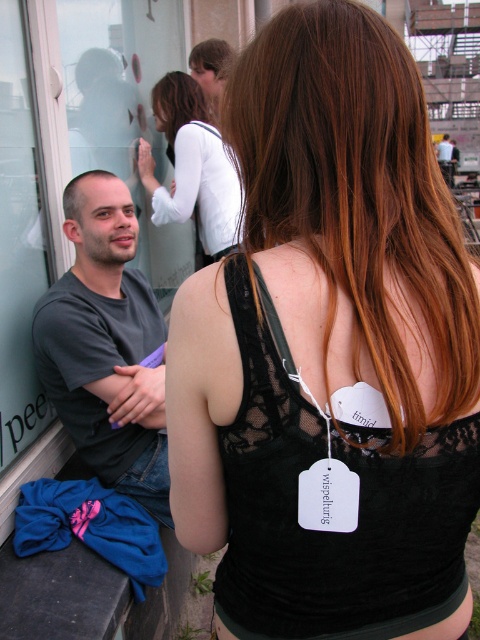
You are a photographer trying to capture the scene. The camera is set to focus on the woman in the foreground. If you want to adjust the focus to include the man in the midground, which direction should you move the focus ring to adjust the focal length? Remember, the brown matte hair at left is at point 0.303, 0.165.

To adjust the focus from the woman in the foreground to the man in the midground, you would need to increase the focal length. However, the exact position of the brown matte hair at left at point (x=79, y=193) indicates that the man is positioned further away than the woman, so moving the focus ring to a longer focal length would bring him into focus.

Consider the image. Where is the white lace blouse at upper center located in the image?

The white lace blouse at upper center is located at point 0.261 on the x axis and 0.400 on the y axis.

From the picture: You are a photographer trying to capture a clear shot of the woman in the foreground. You notice the brown smooth hair at upper center and the matte black tank top at upper center. Which object is positioned lower, making it harder to frame the shot?

The brown smooth hair at upper center is positioned lower than the matte black tank top at upper center, making it harder to frame the shot.